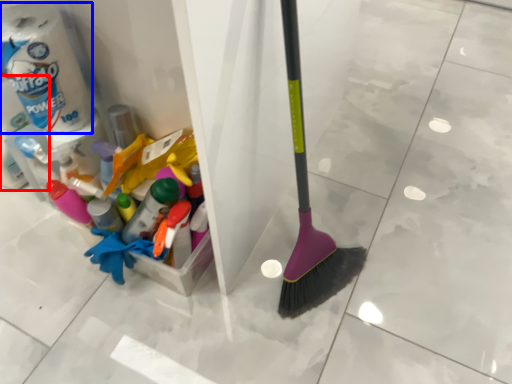
Question: Which object is closer to the camera taking this photo, toilet paper (highlighted by a red box) or toilet paper (highlighted by a blue box)?

Choices:
 (A) toilet paper
 (B) toilet paper

Answer: (B)